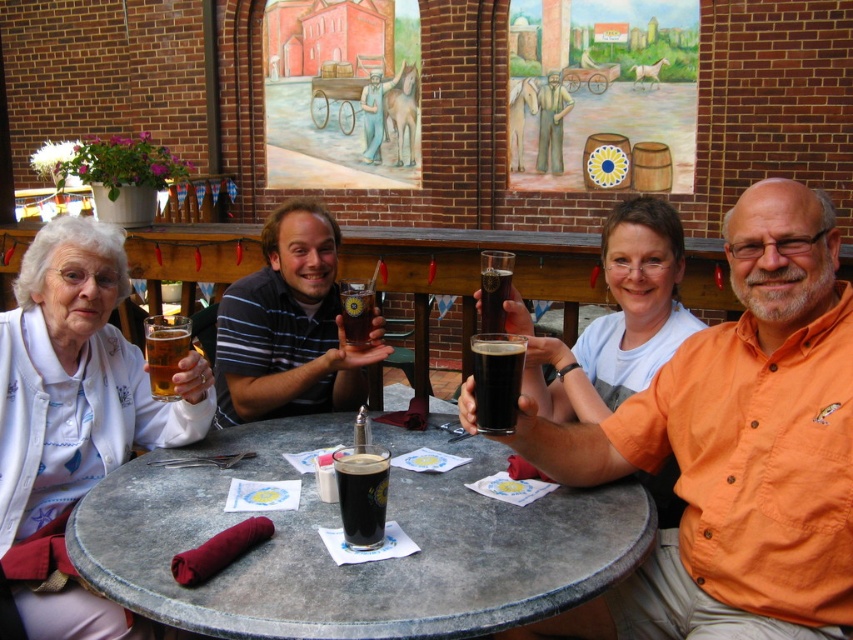
You are a waiter at this outdoor table. You need to place a 30 cm wide tray between the striped cotton shirt at center and the translucent glass mug at center. Will the tray fit without overlapping either item?

The distance between the striped cotton shirt at center and the translucent glass mug at center is 28.39 centimeters. Since the tray is 30 cm wide, it will not fit as it is 1.61 cm wider than the available space.

You are standing in front of the table with four people holding drinks. A point marked at coordinates (714, 604) is part of the table. If you want to place a 1.5 meter long object on the table, will it fit from your current position to that point?

The distance from your current position to the point (714, 604) is 1.65 meters. Since the object is 1.5 meters long, it will fit as there is enough space.

You are standing at the edge of the table and want to reach both points on the table surface. Which point, point (x=505, y=420) or point (x=157, y=326), is closer to you?

Point (x=505, y=420) is closer to the viewer than point (x=157, y=326).